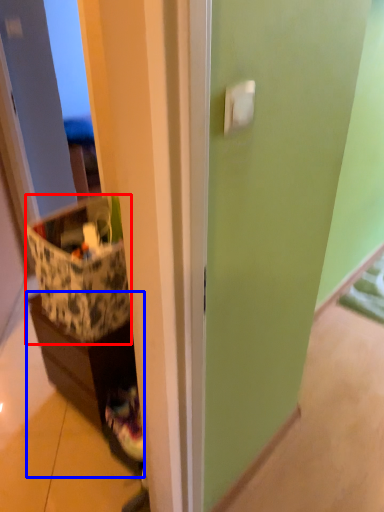
Question: Which of the following is the farthest to the observer, storage box (highlighted by a red box) or cabinetry (highlighted by a blue box)?

Choices:
 (A) storage box
 (B) cabinetry

Answer: (B)